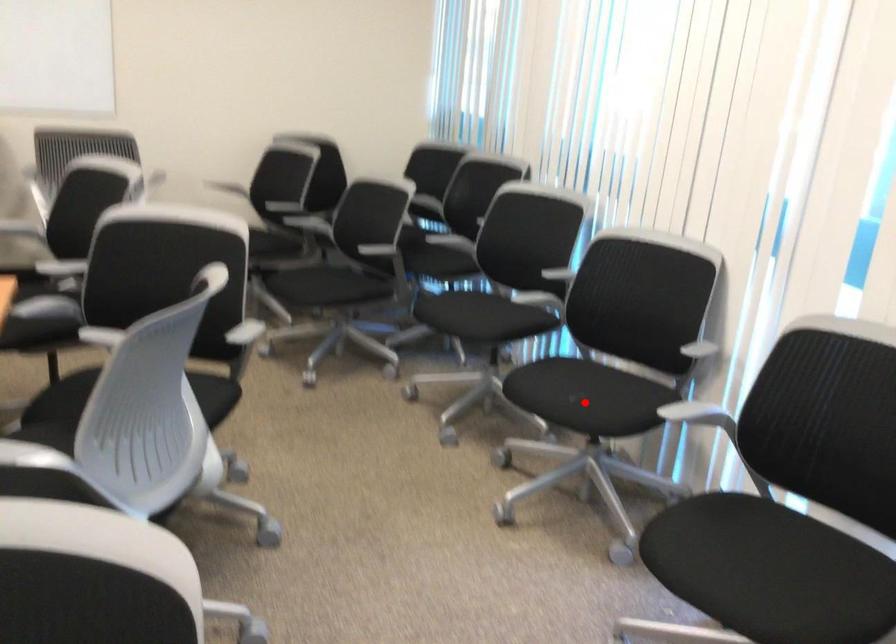
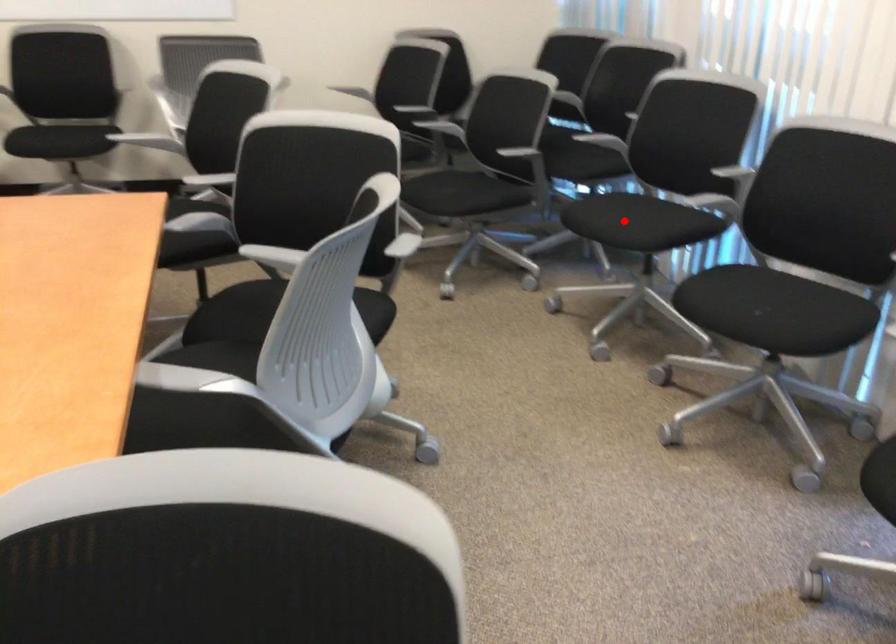
I am providing you with two images of the same scene from different viewpoints. A red point is marked on the first image and another point is marked on the second image. Does the point marked in image1 correspond to the same location as the one in image2?

No